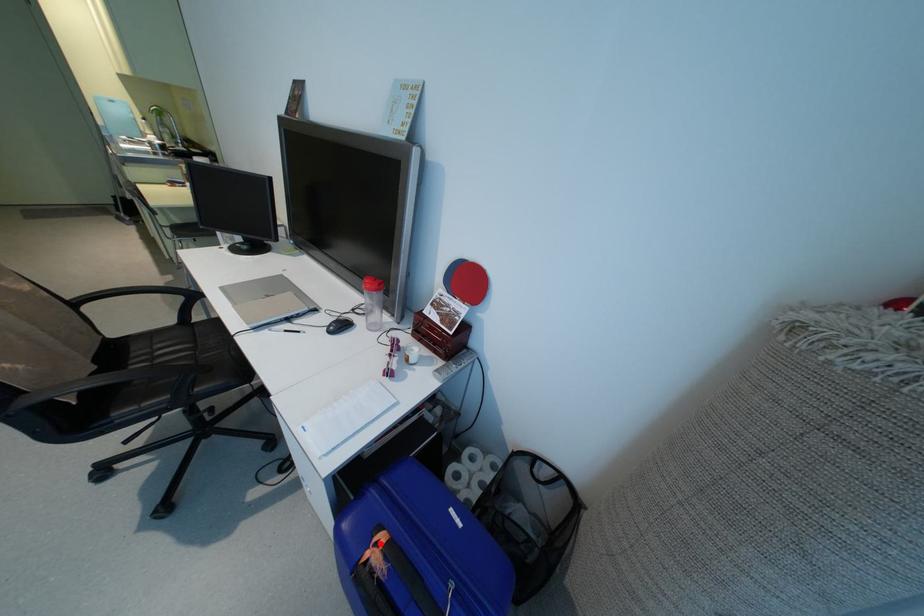
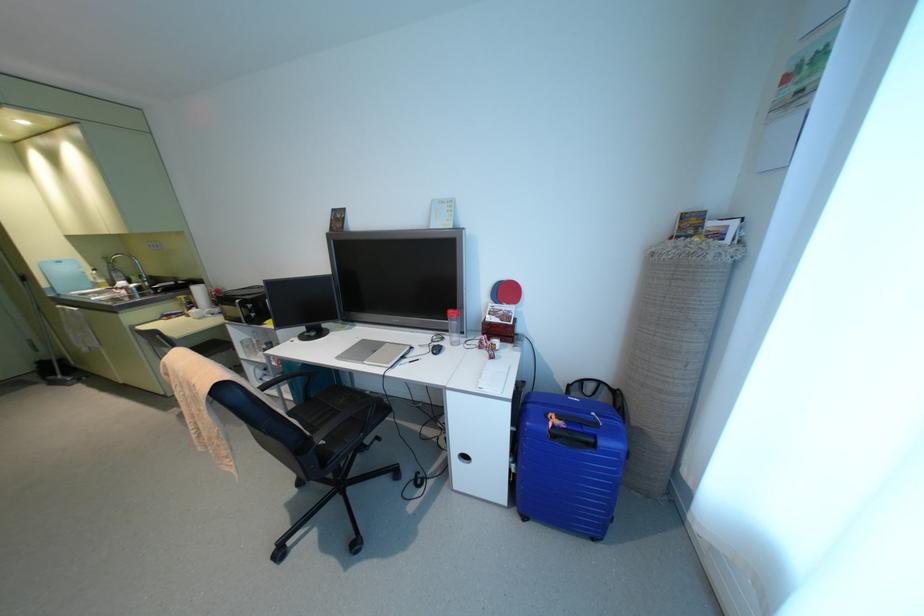
Locate, in the second image, the point that corresponds to the highlighted location in the first image.

(553, 416)